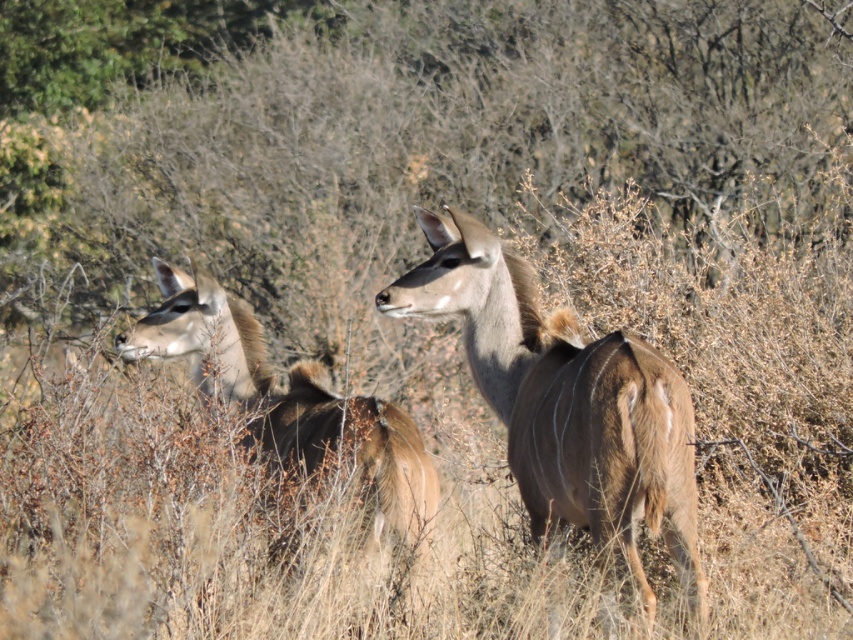
Is brown furry deer at center shorter than brown furry deer at left?

No, brown furry deer at center is not shorter than brown furry deer at left.

Is brown furry deer at center above brown furry deer at left?

No, brown furry deer at center is not above brown furry deer at left.

Locate an element on the screen. Image resolution: width=853 pixels, height=640 pixels. brown furry deer at center is located at coordinates point(566,401).

This screenshot has width=853, height=640. In order to click on brown furry deer at center in this screenshot , I will do tap(566, 401).